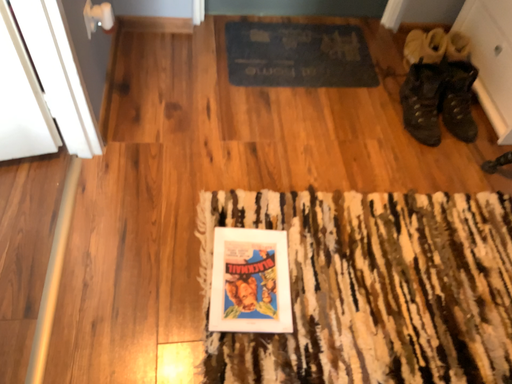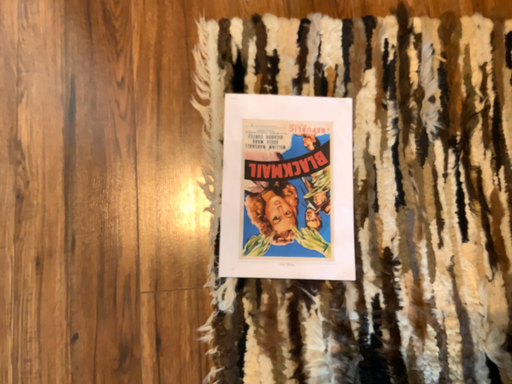
Question: Which way did the camera rotate in the video?

Choices:
 (A) rotated downward
 (B) rotated upward

Answer: (A)